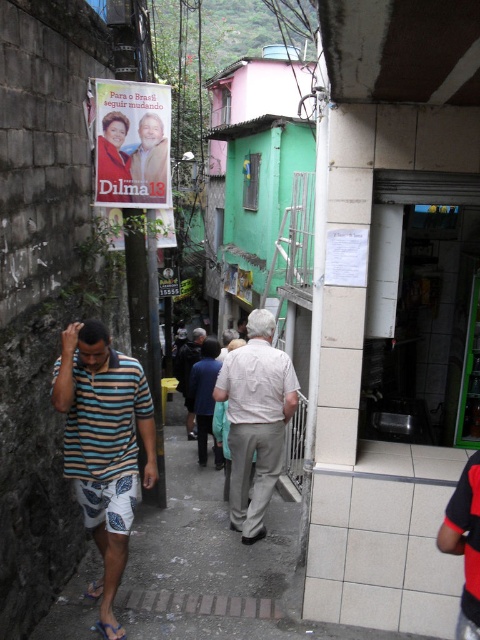
You are a delivery person trying to navigate through the narrow alleyway. You notice a light beige cotton shirt at center and a matte paper poster at upper left. Which object is taller?

The light beige cotton shirt at center is taller than the matte paper poster at upper left according to the description.

You are a delivery person carrying a package and need to navigate through the narrow alleyway. You see a striped cotton shirt at left and a dark blue fabric jacket at center. Which item is taller and might block your path more if you move towards the center?

The striped cotton shirt at left is taller than the dark blue fabric jacket at center, so it might block your path more if you move towards the center.

You are a delivery person carrying a large package that is 1.2 meters wide. You need to walk through the narrow alleyway shown in the image. The light beige cotton shirt at center and the matte paper poster at upper left are in your path. Considering their sizes, will your package fit through the space between these two objects?

The light beige cotton shirt at center is bigger than the matte paper poster at upper left. Since the package is 1.2 meters wide, it might not fit through the space between them if the distance between the two objects is less than 1.2 meters. However, the exact dimensions of the space aren t provided, so it s uncertain without more information.